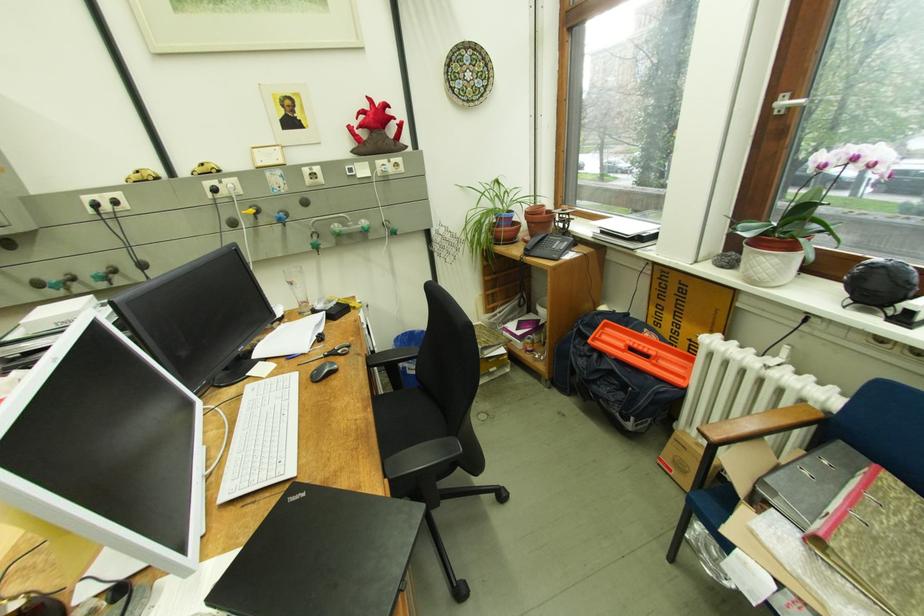
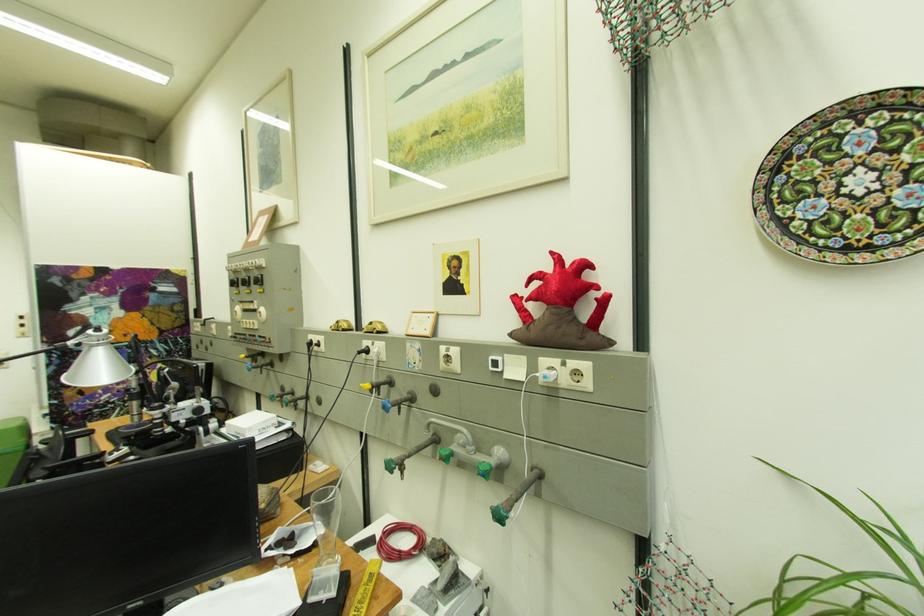
Where in the second image is the point corresponding to pixel 213 166 from the first image?

(382, 323)